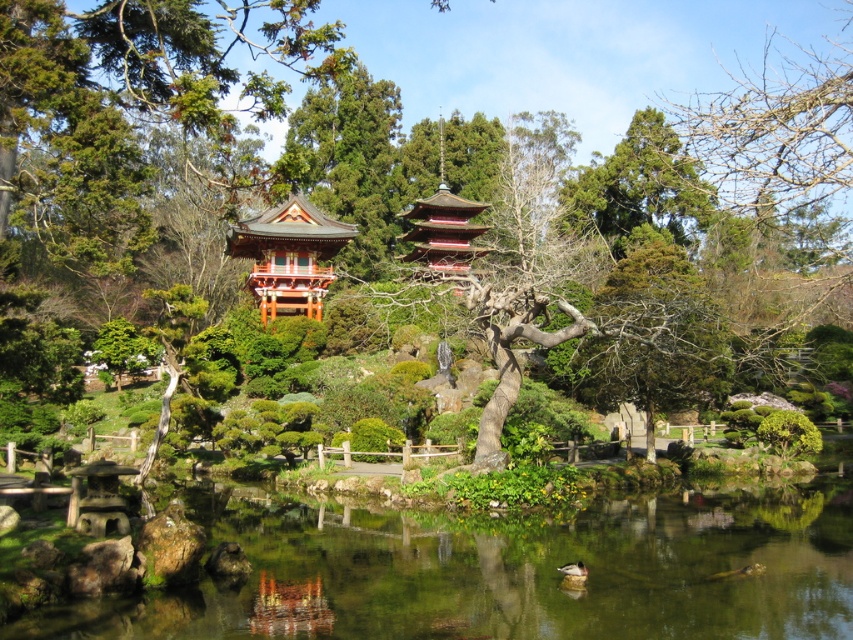
Question: Is clear water at center to the left of shiny red pagoda at center from the viewer's perspective?

Choices:
 (A) no
 (B) yes

Answer: (A)

Question: Which object is closer to the camera taking this photo?

Choices:
 (A) clear water at center
 (B) shiny red pagoda at center

Answer: (A)

Question: Which point is closer to the camera?

Choices:
 (A) (303, 236)
 (B) (537, 525)

Answer: (B)

Question: Can you confirm if clear water at center is positioned to the right of shiny red pagoda at center?

Choices:
 (A) yes
 (B) no

Answer: (A)

Question: Is the position of clear water at center more distant than that of shiny red pagoda at center?

Choices:
 (A) no
 (B) yes

Answer: (A)